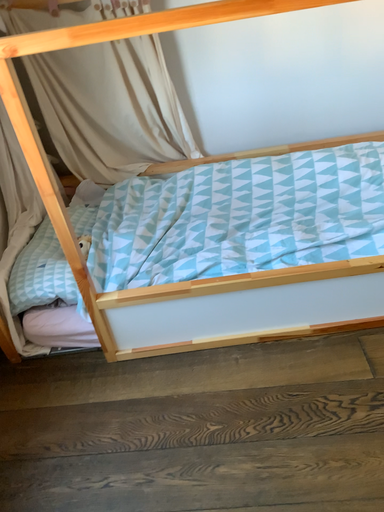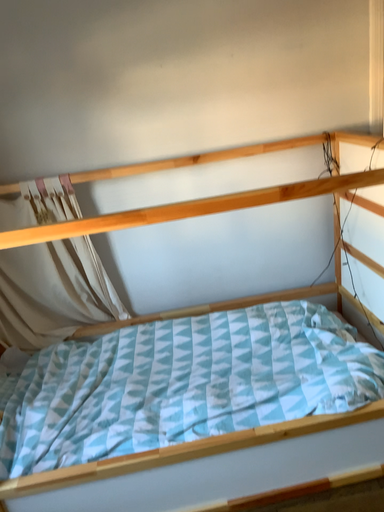
Question: Which way did the camera rotate in the video?

Choices:
 (A) rotated upward
 (B) rotated downward

Answer: (A)